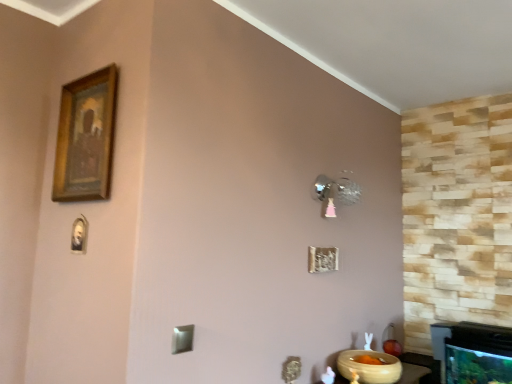
Question: From the image's perspective, is gold wooden picture frame at upper left on top of beige glossy bowl at lower right?

Choices:
 (A) yes
 (B) no

Answer: (A)

Question: Is gold wooden picture frame at upper left surrounding beige glossy bowl at lower right?

Choices:
 (A) yes
 (B) no

Answer: (B)

Question: Is gold wooden picture frame at upper left shorter than beige glossy bowl at lower right?

Choices:
 (A) no
 (B) yes

Answer: (A)

Question: Considering the relative sizes of gold wooden picture frame at upper left and beige glossy bowl at lower right in the image provided, is gold wooden picture frame at upper left smaller than beige glossy bowl at lower right?

Choices:
 (A) yes
 (B) no

Answer: (A)

Question: From the image's perspective, is gold wooden picture frame at upper left beneath beige glossy bowl at lower right?

Choices:
 (A) no
 (B) yes

Answer: (A)

Question: Would you say gold wooden picture frame at upper left is a long distance from beige glossy bowl at lower right?

Choices:
 (A) no
 (B) yes

Answer: (B)

Question: Does beige glossy bowl at lower right have a larger size compared to gold wooden picture frame at upper left?

Choices:
 (A) no
 (B) yes

Answer: (B)

Question: Are beige glossy bowl at lower right and gold wooden picture frame at upper left located far from each other?

Choices:
 (A) yes
 (B) no

Answer: (A)

Question: Is beige glossy bowl at lower right outside gold wooden picture frame at upper left?

Choices:
 (A) yes
 (B) no

Answer: (A)

Question: From a real-world perspective, is beige glossy bowl at lower right positioned under gold wooden picture frame at upper left based on gravity?

Choices:
 (A) no
 (B) yes

Answer: (B)

Question: Is beige glossy bowl at lower right oriented away from gold wooden picture frame at upper left?

Choices:
 (A) no
 (B) yes

Answer: (A)

Question: Is beige glossy bowl at lower right wider than gold wooden picture frame at upper left?

Choices:
 (A) no
 (B) yes

Answer: (B)

Question: Does point (64, 160) appear closer or farther from the camera than point (367, 372)?

Choices:
 (A) closer
 (B) farther

Answer: (A)